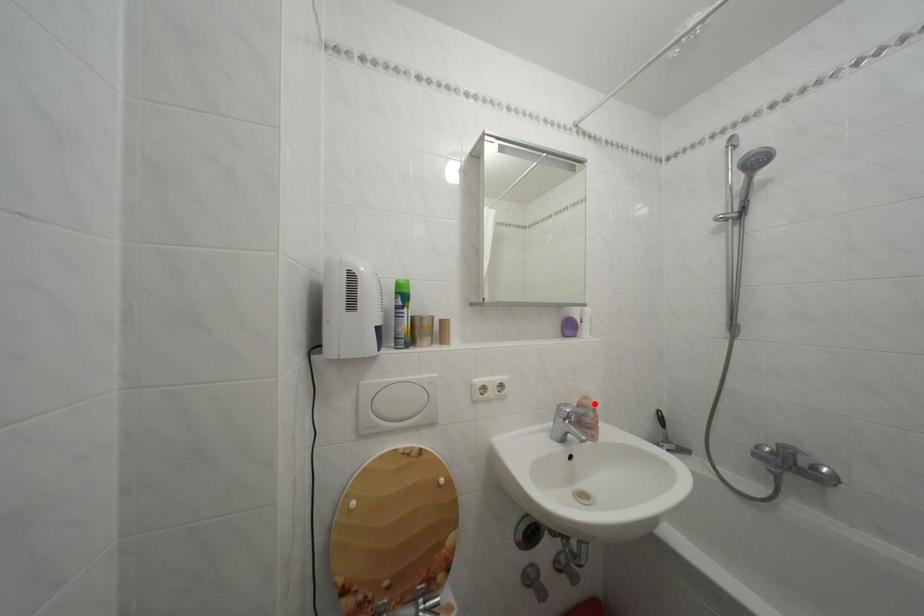
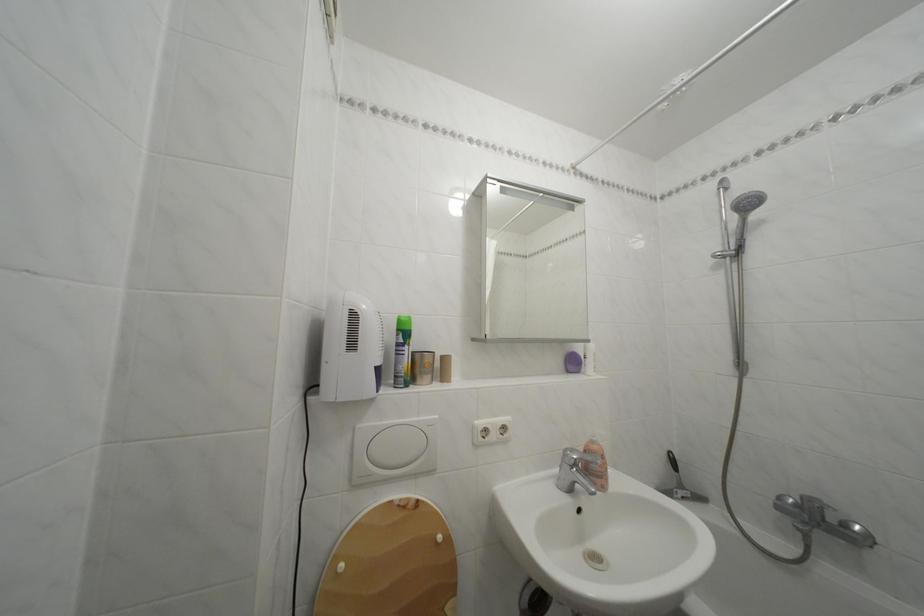
Locate, in the second image, the point that corresponds to the highlighted location in the first image.

(602, 448)